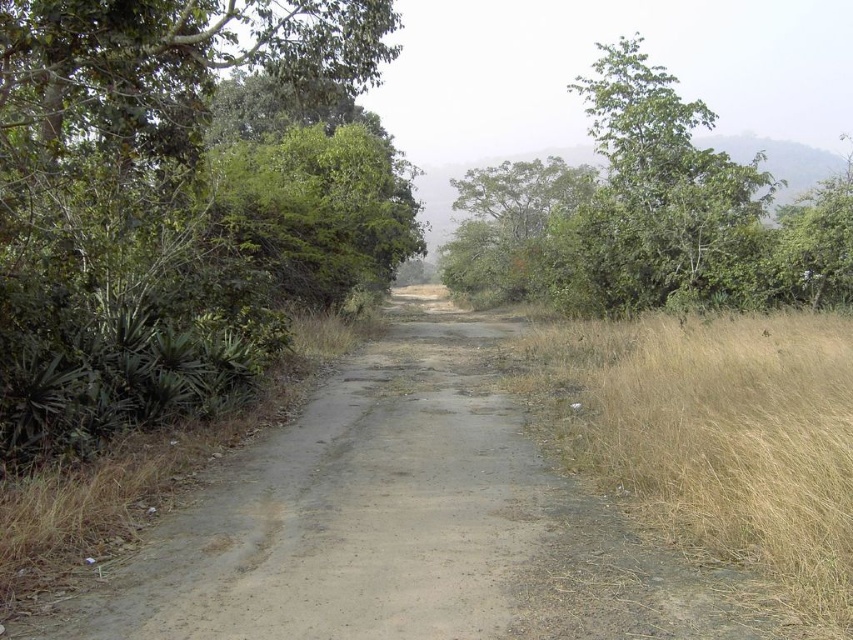
Can you confirm if dry grass at right is bigger than green leafy tree at upper center?

No.

Does dry grass at right appear on the right side of green leafy tree at upper center?

Incorrect, dry grass at right is not on the right side of green leafy tree at upper center.

This screenshot has width=853, height=640. What are the coordinates of `dry grass at right` in the screenshot? It's located at (712, 435).

Locate an element on the screen. dry grass at right is located at coordinates (712, 435).

Does green leafy tree at left appear under green leafy tree at upper center?

Correct, green leafy tree at left is located below green leafy tree at upper center.

Measure the distance from green leafy tree at left to green leafy tree at upper center.

The distance of green leafy tree at left from green leafy tree at upper center is 13.56 meters.

Who is more forward, (247,113) or (685,102)?

Point (247,113) is more forward.

Find the location of a particular element. green leafy tree at left is located at coordinates (178, 202).

Measure the distance between point (18, 275) and camera.

7.74 meters

At what (x,y) coordinates should I click in order to perform the action: click on green leafy tree at left. Please return your answer as a coordinate pair (x, y). The image size is (853, 640). Looking at the image, I should click on (178, 202).